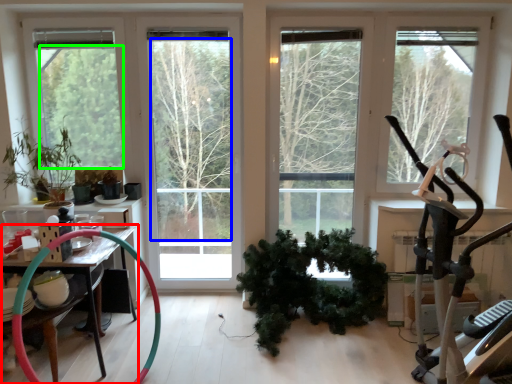
Question: Which object is the farthest from table (highlighted by a red box)? Choose among these: tree (highlighted by a blue box) or tree (highlighted by a green box).

Choices:
 (A) tree
 (B) tree

Answer: (A)